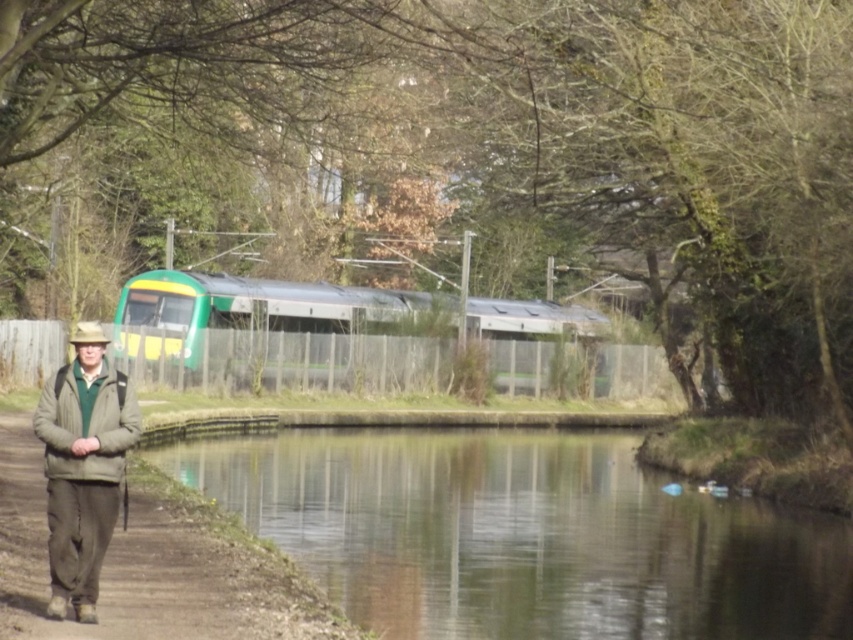
Which is behind, point (285, 625) or point (70, 550)?

Point (285, 625)

Who is more distant from viewer, (173, 545) or (91, 456)?

Point (173, 545)

Identify the location of dull brown dirt path at lower left. The width and height of the screenshot is (853, 640). (154, 564).

Who is positioned more to the right, green glassy water at center or khaki fabric jacket at lower left?

From the viewer's perspective, green glassy water at center appears more on the right side.

Between point (267, 442) and point (99, 422), which one is positioned in front?

Point (99, 422) is more forward.

In order to click on green glassy water at center in this screenshot , I will do pyautogui.click(x=524, y=536).

Can you confirm if green glassy water at center is smaller than dull brown dirt path at lower left?

Incorrect, green glassy water at center is not smaller in size than dull brown dirt path at lower left.

Who is more forward, (496, 522) or (260, 618)?

Point (260, 618) is in front.

Which is in front, point (590, 529) or point (152, 483)?

Point (152, 483) is in front.

At what (x,y) coordinates should I click in order to perform the action: click on green glassy water at center. Please return your answer as a coordinate pair (x, y). This screenshot has height=640, width=853. Looking at the image, I should click on (524, 536).